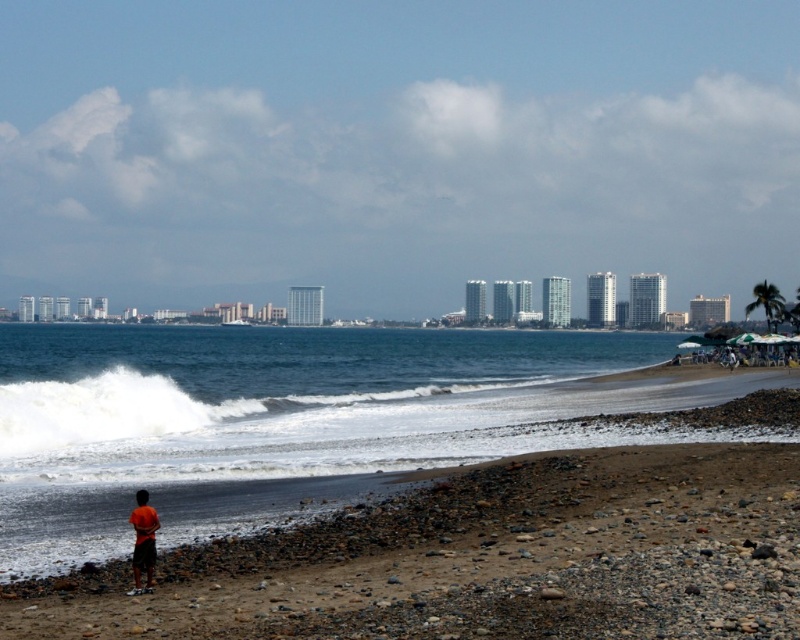
Question: From the image, what is the correct spatial relationship of blue water at lower left in relation to orange fabric shorts at lower left?

Choices:
 (A) left
 (B) right

Answer: (A)

Question: Which object appears closest to the camera in this image?

Choices:
 (A) orange fabric shorts at lower left
 (B) blue water at lower left

Answer: (A)

Question: Which point is farther from the camera taking this photo?

Choices:
 (A) (12, 326)
 (B) (132, 563)

Answer: (A)

Question: Is blue water at lower left positioned behind orange fabric shorts at lower left?

Choices:
 (A) no
 (B) yes

Answer: (B)

Question: Can you confirm if blue water at lower left is thinner than orange fabric shorts at lower left?

Choices:
 (A) yes
 (B) no

Answer: (B)